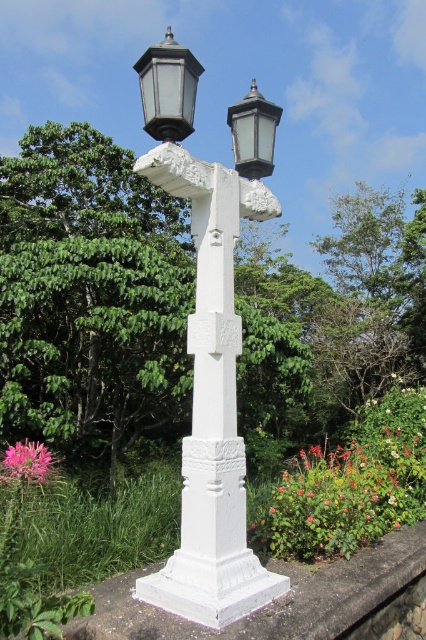
Question: Which point is closer to the camera?

Choices:
 (A) (109, 177)
 (B) (158, 124)

Answer: (B)

Question: Observing the image, what is the correct spatial positioning of matte black lantern at upper right in reference to pink matte flower at center?

Choices:
 (A) below
 (B) above

Answer: (B)

Question: Which object is farther from the camera taking this photo?

Choices:
 (A) white stone street light at center
 (B) matte black lantern at upper left
 (C) pink matte flower at lower left

Answer: (B)

Question: Does matte black lantern at upper left come in front of matte black lantern at upper right?

Choices:
 (A) no
 (B) yes

Answer: (B)

Question: Which point is farther to the camera?

Choices:
 (A) pink matte flower at lower left
 (B) matte black lantern at upper right
 (C) green leafy tree at center
 (D) pink matte flower at center

Answer: (C)

Question: Can you confirm if green leafy tree at center is positioned above matte black lantern at upper left?

Choices:
 (A) no
 (B) yes

Answer: (A)